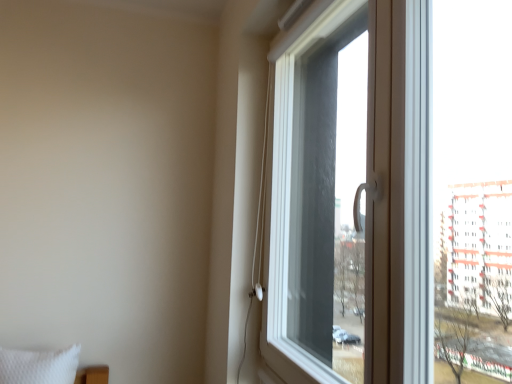
What do you see at coordinates (391, 197) in the screenshot? This screenshot has height=384, width=512. I see `white plastic window at right` at bounding box center [391, 197].

Image resolution: width=512 pixels, height=384 pixels. Find the location of `white plastic window at right`. white plastic window at right is located at coordinates (391, 197).

Where is `white plastic window at right`? white plastic window at right is located at coordinates (391, 197).